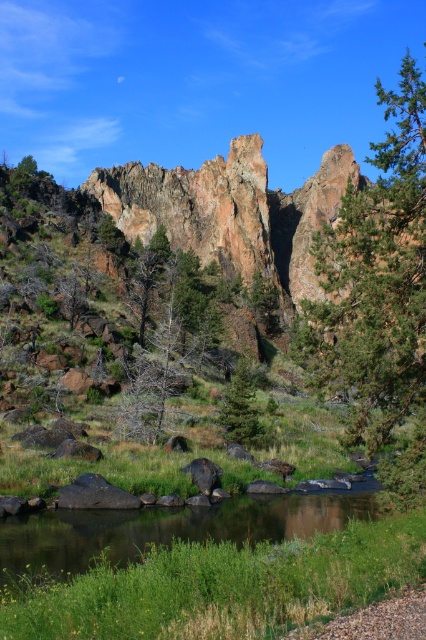
Does green textured tree at right appear on the left side of brown/dry wood tree at center?

Incorrect, green textured tree at right is not on the left side of brown/dry wood tree at center.

Is green textured tree at right smaller than brown/dry wood tree at center?

Incorrect, green textured tree at right is not smaller in size than brown/dry wood tree at center.

You are a GUI agent. You are given a task and a screenshot of the screen. Output one action in this format:
    pyautogui.click(x=<x>, y=<y>)
    Task: Click on the green textured tree at right
    
    Given the screenshot: What is the action you would take?
    pyautogui.click(x=379, y=296)

Is brown/dry wood tree at center to the right of smooth gray rock at center from the viewer's perspective?

No, brown/dry wood tree at center is not to the right of smooth gray rock at center.

Can you confirm if brown/dry wood tree at center is positioned above smooth gray rock at center?

Yes, brown/dry wood tree at center is above smooth gray rock at center.

Between point (155, 384) and point (190, 474), which one is positioned behind?

Positioned behind is point (155, 384).

You are a GUI agent. You are given a task and a screenshot of the screen. Output one action in this format:
    pyautogui.click(x=<x>, y=<y>)
    Task: Click on the brown/dry wood tree at center
    
    Given the screenshot: What is the action you would take?
    pyautogui.click(x=161, y=356)

Who is positioned more to the right, green textured tree at right or green matte tree at center?

green textured tree at right

Can you confirm if green textured tree at right is positioned to the right of green matte tree at center?

Yes, green textured tree at right is to the right of green matte tree at center.

At what (x,y) coordinates should I click in order to perform the action: click on green textured tree at right. Please return your answer as a coordinate pair (x, y). This screenshot has width=426, height=640. Looking at the image, I should click on (379, 296).